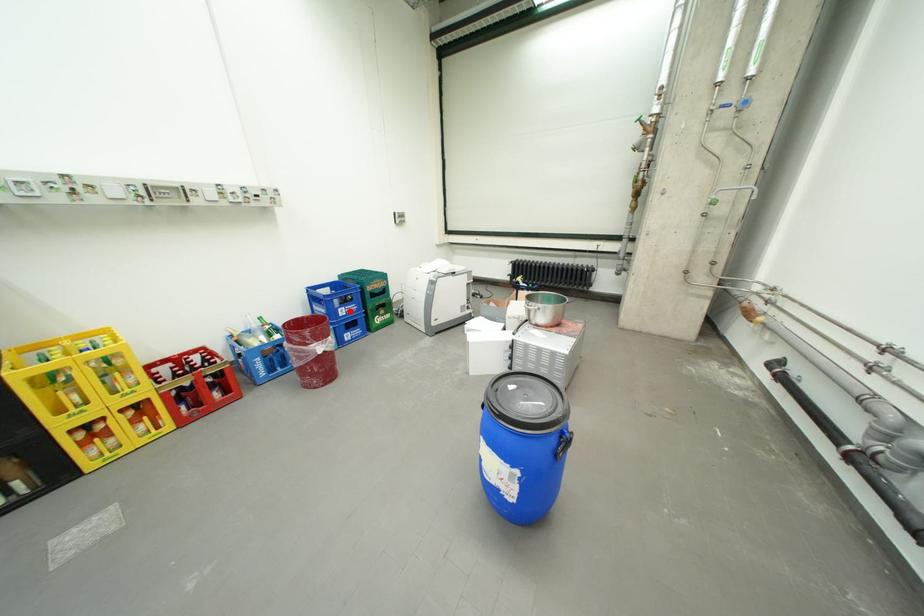
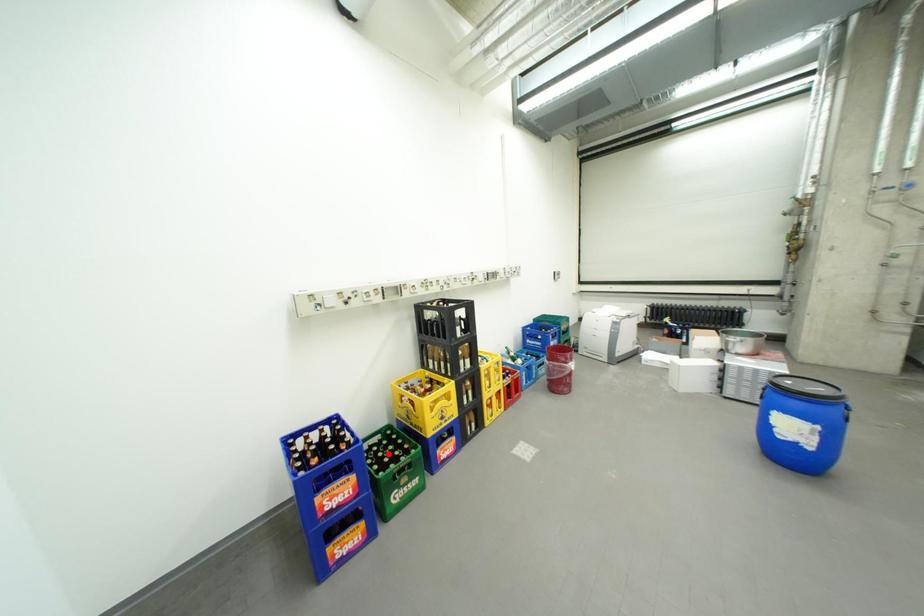
I am providing you with two images of the same scene from different viewpoints. A red point is marked on the first image and another point is marked on the second image. Do the highlighted points in image1 and image2 indicate the same real-world spot?

No